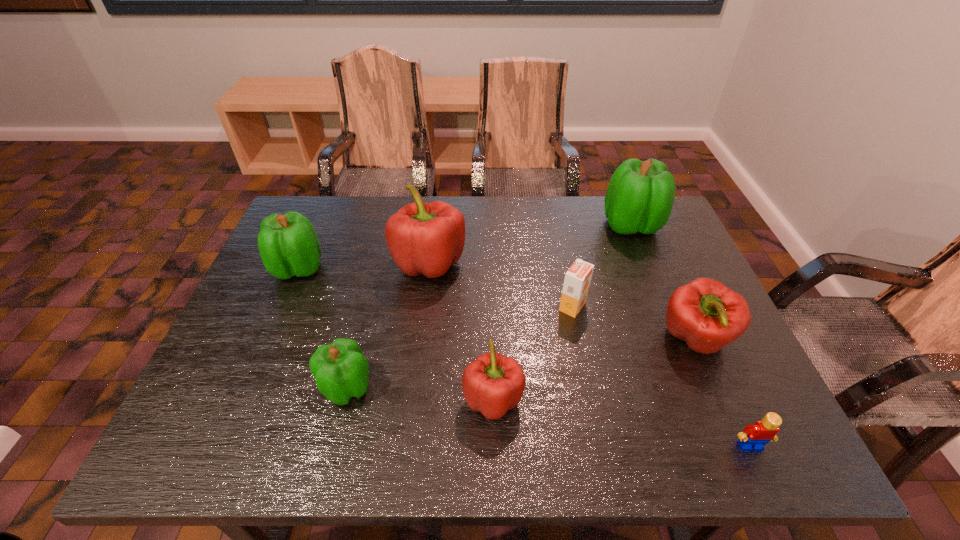
The image size is (960, 540). I want to click on free space at the near edge of the desktop, so click(324, 424).

Image resolution: width=960 pixels, height=540 pixels. What are the coordinates of `vacant space at the left edge of the desktop` in the screenshot? It's located at (267, 298).

Where is `vacant space at the right edge of the desktop`? vacant space at the right edge of the desktop is located at coordinates (666, 260).

Locate an element on the screen. vacant space at the far left corner is located at coordinates (x=333, y=226).

Identify the location of empty location between the leftmost bell pepper and the nearest green bell pepper. This screenshot has height=540, width=960. (323, 328).

This screenshot has width=960, height=540. Find the location of `vacant space that is in between the fourth object from right to left and the nearest green bell pepper`. vacant space that is in between the fourth object from right to left and the nearest green bell pepper is located at coordinates (460, 347).

At what (x,y) coordinates should I click in order to perform the action: click on free spot between the biggest pink bell pepper and the smallest green bell pepper. Please return your answer as a coordinate pair (x, y). Looking at the image, I should click on (388, 325).

Where is `empty space that is in between the nearest object and the nearest green bell pepper`? The image size is (960, 540). empty space that is in between the nearest object and the nearest green bell pepper is located at coordinates (548, 417).

This screenshot has width=960, height=540. I want to click on free space between the orange juice and the farthest pink bell pepper, so click(501, 285).

Where is `unoccupied position between the nearest pink bell pepper and the nearest green bell pepper`? unoccupied position between the nearest pink bell pepper and the nearest green bell pepper is located at coordinates (420, 393).